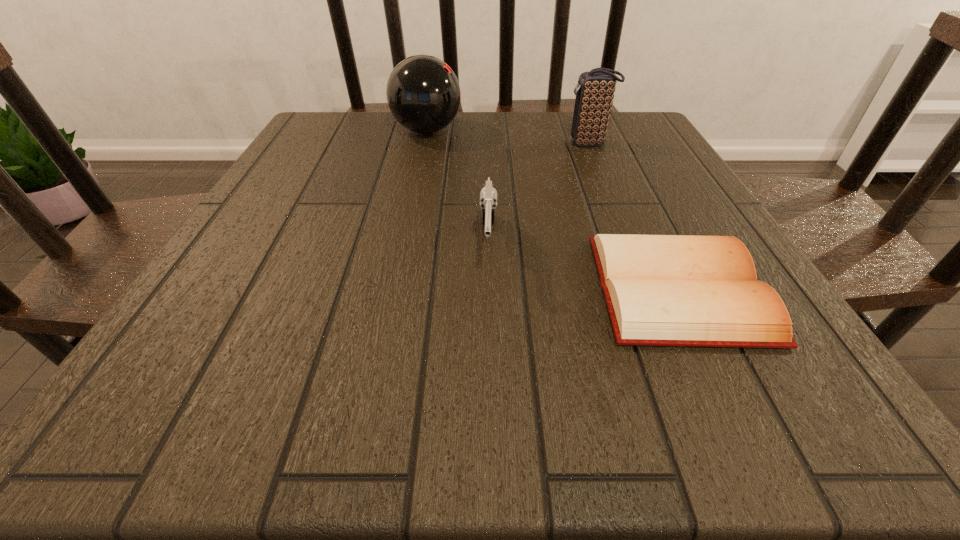
Find the location of a particular element. This screenshot has height=540, width=960. blank space located on the left of the Bible is located at coordinates (554, 288).

The image size is (960, 540). In order to click on bowling ball at the far edge in this screenshot , I will do `click(423, 93)`.

The width and height of the screenshot is (960, 540). I want to click on clutch bag that is at the far edge, so click(x=594, y=91).

Find the location of a particular element. This screenshot has height=540, width=960. clutch bag that is positioned at the right edge is located at coordinates (594, 91).

The width and height of the screenshot is (960, 540). In order to click on Bible that is at the right edge in this screenshot , I will do `click(661, 290)`.

Identify the location of object that is at the far right corner. The image size is (960, 540). (594, 91).

Identify the location of vacant space at the far edge. This screenshot has width=960, height=540. (521, 116).

This screenshot has height=540, width=960. Find the location of `free location at the left edge of the desktop`. free location at the left edge of the desktop is located at coordinates (215, 339).

Find the location of a particular element. The height and width of the screenshot is (540, 960). vacant space at the right edge of the desktop is located at coordinates (654, 158).

Identify the location of vacant space that is in between the bowling ball and the clutch bag. (508, 137).